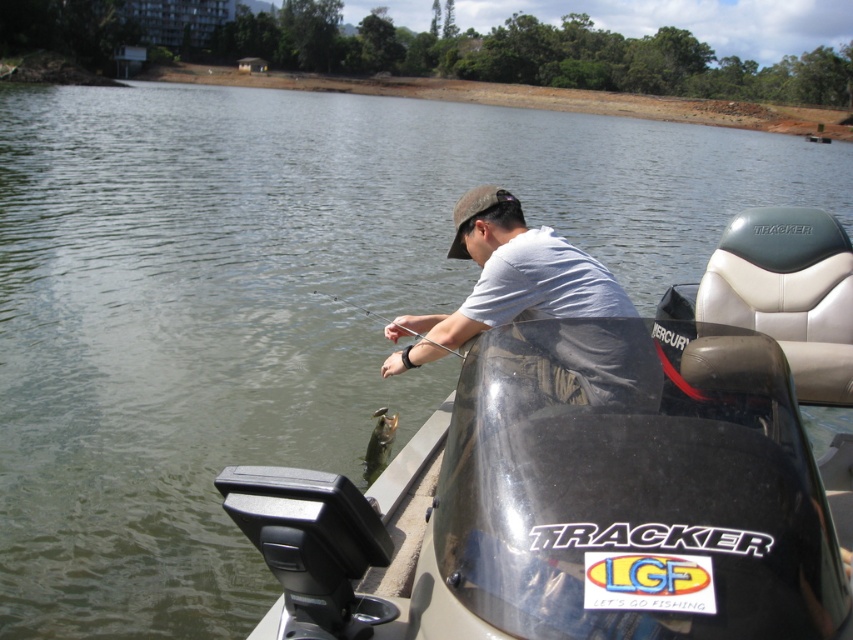
You are a photographer aiming to capture the reflection of the white matte shirt at center and the shiny silver fish at lower center in the lake. Which object will have a wider reflection on the water surface?

The white matte shirt at center has a wider reflection on the water surface because its width surpasses that of the shiny silver fish at lower center.

From the picture: You are a photographer trying to capture the white matte shirt at center and the shiny silver fish at lower center in the same frame. Which object should you focus on first to ensure both are in focus?

The white matte shirt at center is positioned over the shiny silver fish at lower center, so focusing on the white matte shirt at center first will ensure both are in focus since it is closer to the camera.

You are a photographer trying to capture a closeup of the shiny silver fish at lower center while also including the white matte shirt at center in the frame. Given their sizes, which object should you zoom in more on to ensure both are visible and properly framed?

The white matte shirt at center is larger in size than the shiny silver fish at lower center. To include both in the frame while ensuring proper visibility, you should zoom out slightly to accommodate the larger shirt and still capture the smaller fish.